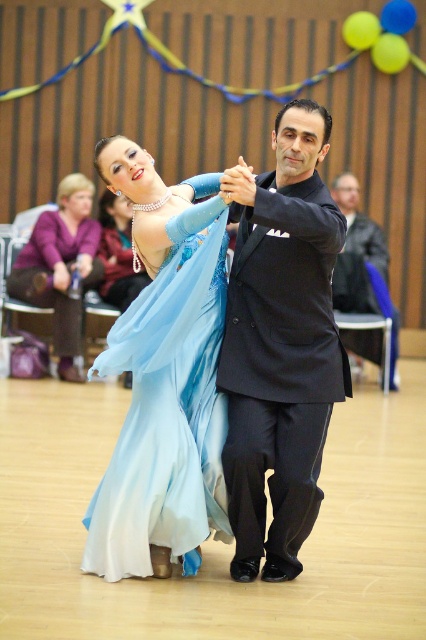
You are a photographer at the event and want to capture a photo of the light blue satin dress at center and the black smooth suit at center. Which one is positioned lower in the image?

The light blue satin dress at center is below the black smooth suit at center, so it is positioned lower in the image.

You are a photographer at the event and want to capture a photo of both the matte purple dress at upper left and the black smooth suit at center. However, you can only focus on one subject at a time. Which one should you focus on to ensure the other is still visible in the background?

You should focus on the matte purple dress at upper left because it is in front of the black smooth suit at center, so the black smooth suit at center will be in the background and still visible.

Based on the photo, you are a photographer standing at the front of the dance hall. You want to take a photo of the two points mentioned in the scene. Which point is closer to you, point [132,305] or point [376,236]?

Point [132,305] is closer to the viewer than point [376,236], so it will be closer to you as the photographer.